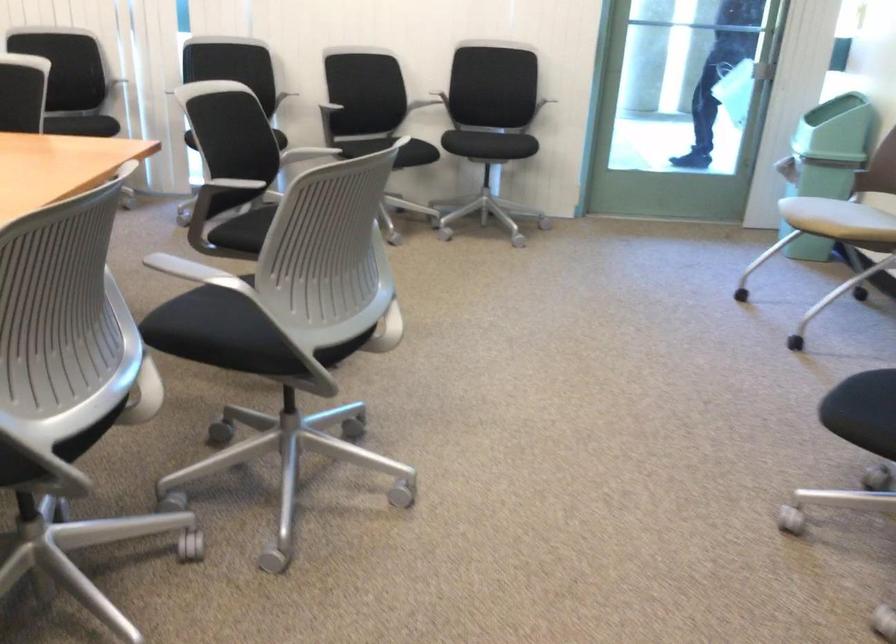
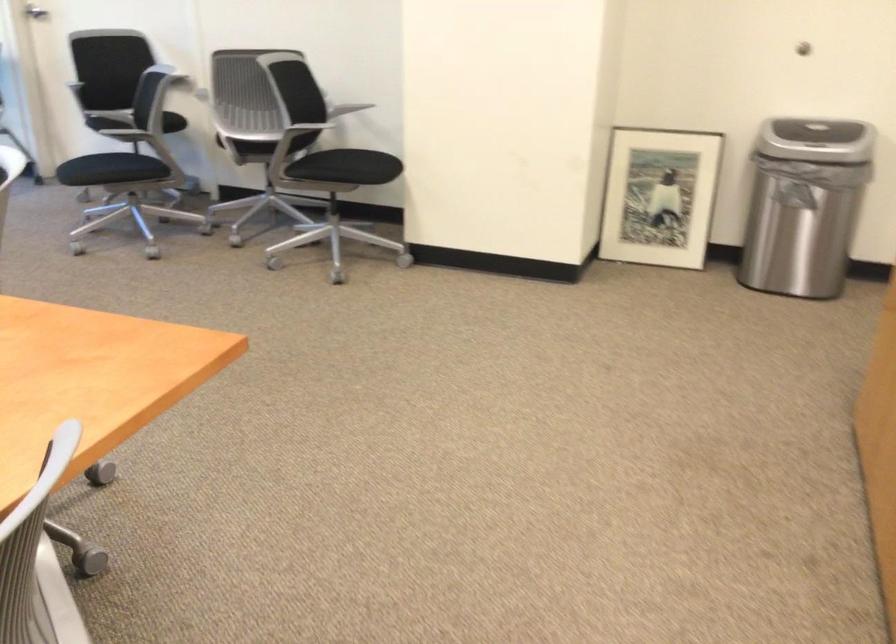
In the second image, find the point that corresponds to (824,413) in the first image.

(112, 171)